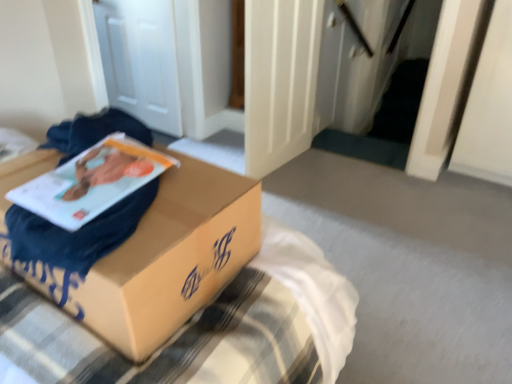
Question: Is matte paper at center thinner than matte cardboard box at center?

Choices:
 (A) no
 (B) yes

Answer: (B)

Question: From the image's perspective, is matte paper at center below matte cardboard box at center?

Choices:
 (A) no
 (B) yes

Answer: (A)

Question: Is matte paper at center positioned with its back to matte cardboard box at center?

Choices:
 (A) no
 (B) yes

Answer: (B)

Question: Considering the relative sizes of matte paper at center and matte cardboard box at center in the image provided, is matte paper at center smaller than matte cardboard box at center?

Choices:
 (A) yes
 (B) no

Answer: (A)

Question: Does matte paper at center have a larger size compared to matte cardboard box at center?

Choices:
 (A) yes
 (B) no

Answer: (B)

Question: Would you consider matte paper at center to be distant from matte cardboard box at center?

Choices:
 (A) no
 (B) yes

Answer: (A)

Question: From the image's perspective, is matte cardboard box at center beneath matte paper at center?

Choices:
 (A) no
 (B) yes

Answer: (B)

Question: Is matte cardboard box at center turned away from matte paper at center?

Choices:
 (A) yes
 (B) no

Answer: (B)

Question: Is matte cardboard box at center outside matte paper at center?

Choices:
 (A) no
 (B) yes

Answer: (B)

Question: Is matte cardboard box at center positioned behind matte paper at center?

Choices:
 (A) yes
 (B) no

Answer: (B)

Question: Can you confirm if matte cardboard box at center is shorter than matte paper at center?

Choices:
 (A) yes
 (B) no

Answer: (B)

Question: Are matte cardboard box at center and matte paper at center located far from each other?

Choices:
 (A) yes
 (B) no

Answer: (B)

Question: In terms of width, does matte cardboard box at center look wider or thinner when compared to matte paper at center?

Choices:
 (A) thin
 (B) wide

Answer: (B)